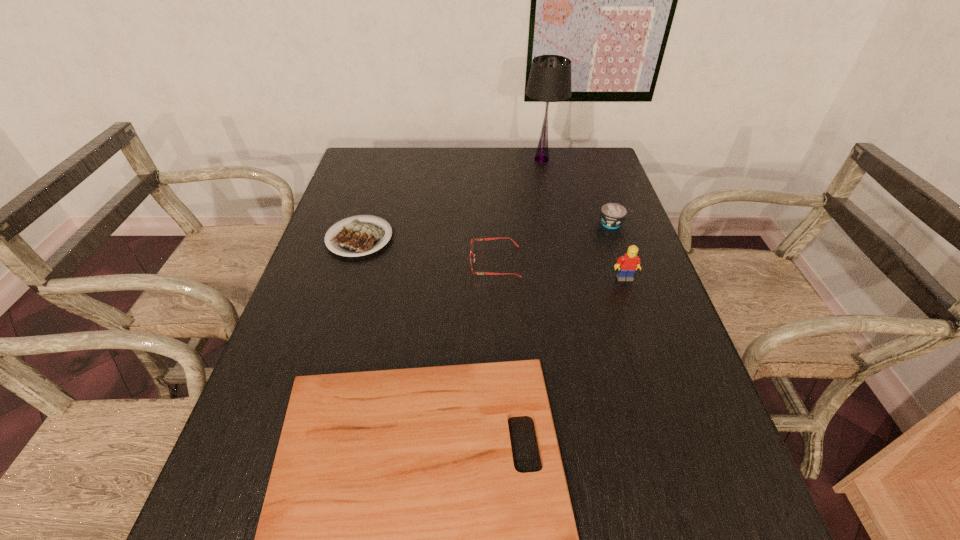
Identify the location of vacant area situated 0.230m on the front of the yogurt. (636, 289).

This screenshot has width=960, height=540. Identify the location of vacant space located on the lenses of the spectacles. (335, 262).

Locate an element on the screen. The height and width of the screenshot is (540, 960). free spot located on the lenses of the spectacles is located at coordinates (414, 262).

The width and height of the screenshot is (960, 540). Find the location of `free region located 0.180m on the lenses of the spectacles`. free region located 0.180m on the lenses of the spectacles is located at coordinates (402, 262).

The image size is (960, 540). In order to click on vacant space located 0.230m on the right of the plate in this screenshot , I will do `click(479, 238)`.

Image resolution: width=960 pixels, height=540 pixels. Identify the location of object present at the far edge. (550, 76).

Where is `object that is at the left edge`? The image size is (960, 540). object that is at the left edge is located at coordinates (358, 238).

Locate an element on the screen. lampshade located in the right edge section of the desktop is located at coordinates (550, 76).

The width and height of the screenshot is (960, 540). Identify the location of Lego that is at the right edge. (627, 264).

Locate an element on the screen. yogurt that is at the right edge is located at coordinates tap(612, 214).